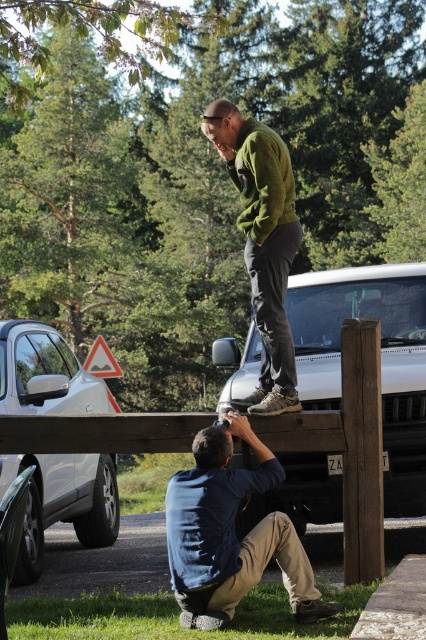
Question: Is white matte car at center thinner than green matte sweater at upper center?

Choices:
 (A) no
 (B) yes

Answer: (B)

Question: Which object is closer to the camera taking this photo?

Choices:
 (A) blue denim shirt at lower center
 (B) green matte sweater at upper center
 (C) white matte car at center
 (D) silver metallic car at left

Answer: (A)

Question: Does silver metallic car at left come behind green matte sweater at upper center?

Choices:
 (A) no
 (B) yes

Answer: (B)

Question: Does white matte car at center appear over blue denim shirt at lower center?

Choices:
 (A) yes
 (B) no

Answer: (B)

Question: Which object is closer to the camera taking this photo?

Choices:
 (A) silver metallic car at left
 (B) blue denim shirt at lower center
 (C) green matte sweater at upper center

Answer: (B)

Question: Estimate the real-world distances between objects in this image. Which object is closer to the silver metallic car at left?

Choices:
 (A) white matte car at center
 (B) blue denim shirt at lower center

Answer: (A)